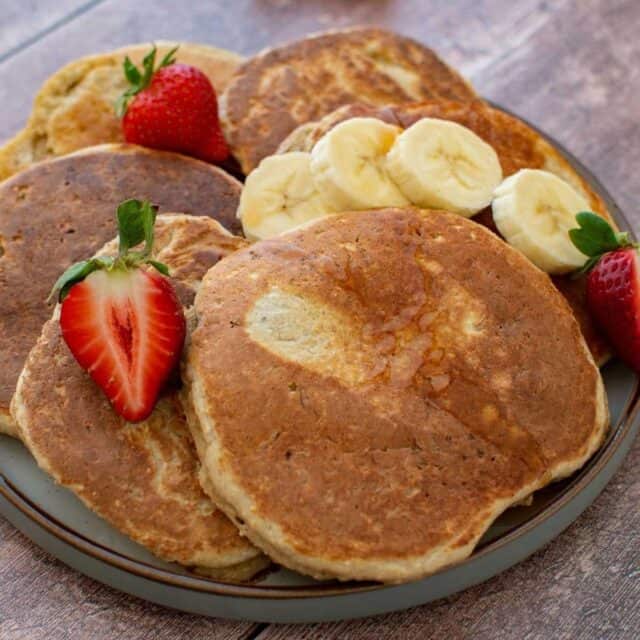
Locate an element on the screen. Image resolution: width=640 pixels, height=640 pixels. plate is located at coordinates (496, 548).